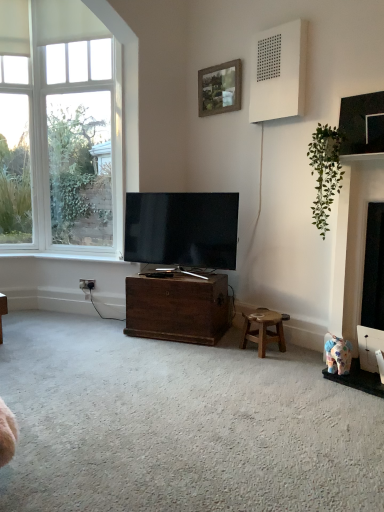
Question: From a real-world perspective, does matte black tv at center sit lower than wooden frame at upper center?

Choices:
 (A) yes
 (B) no

Answer: (A)

Question: Considering the relative sizes of matte black tv at center and wooden frame at upper center in the image provided, is matte black tv at center smaller than wooden frame at upper center?

Choices:
 (A) no
 (B) yes

Answer: (A)

Question: Considering the relative sizes of matte black tv at center and wooden frame at upper center in the image provided, is matte black tv at center taller than wooden frame at upper center?

Choices:
 (A) yes
 (B) no

Answer: (A)

Question: Can you confirm if matte black tv at center is thinner than wooden frame at upper center?

Choices:
 (A) yes
 (B) no

Answer: (B)

Question: From the image's perspective, is matte black tv at center located beneath wooden frame at upper center?

Choices:
 (A) no
 (B) yes

Answer: (B)

Question: From the image's perspective, would you say matte black tv at center is positioned over wooden frame at upper center?

Choices:
 (A) yes
 (B) no

Answer: (B)

Question: Can you confirm if white plastic power outlet at lower left is smaller than wooden frame at upper center?

Choices:
 (A) yes
 (B) no

Answer: (A)

Question: Is white plastic power outlet at lower left positioned with its back to wooden frame at upper center?

Choices:
 (A) yes
 (B) no

Answer: (B)

Question: Is white plastic power outlet at lower left not within wooden frame at upper center?

Choices:
 (A) no
 (B) yes

Answer: (B)

Question: Can you confirm if white plastic power outlet at lower left is thinner than wooden frame at upper center?

Choices:
 (A) no
 (B) yes

Answer: (B)

Question: Is white plastic power outlet at lower left at the left side of wooden frame at upper center?

Choices:
 (A) yes
 (B) no

Answer: (A)

Question: Is white plastic power outlet at lower left placed right next to wooden frame at upper center?

Choices:
 (A) yes
 (B) no

Answer: (B)

Question: Is white matte speaker at upper right at the left side of wooden frame at upper center?

Choices:
 (A) no
 (B) yes

Answer: (A)